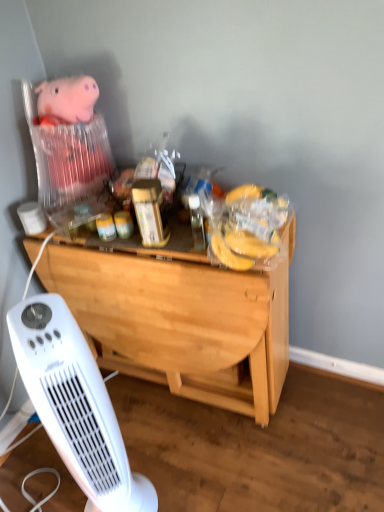
Where is `vacant space to the right of white plastic heater at lower left`? vacant space to the right of white plastic heater at lower left is located at coordinates (184, 478).